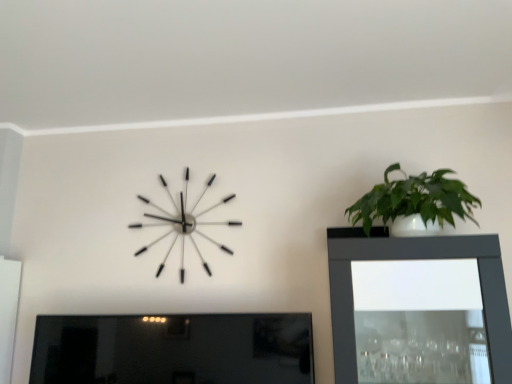
Question: From their relative heights in the image, would you say matte black picture frame at lower left is taller or shorter than metallic silver clock at upper left?

Choices:
 (A) tall
 (B) short

Answer: (B)

Question: Is matte black picture frame at lower left bigger or smaller than metallic silver clock at upper left?

Choices:
 (A) small
 (B) big

Answer: (B)

Question: Which is farther from the green glossy plant at upper right?

Choices:
 (A) matte black picture frame at lower left
 (B) metallic silver clock at upper left

Answer: (A)

Question: Which object is the farthest from the metallic silver clock at upper left?

Choices:
 (A) green glossy plant at upper right
 (B) matte black picture frame at lower left

Answer: (A)